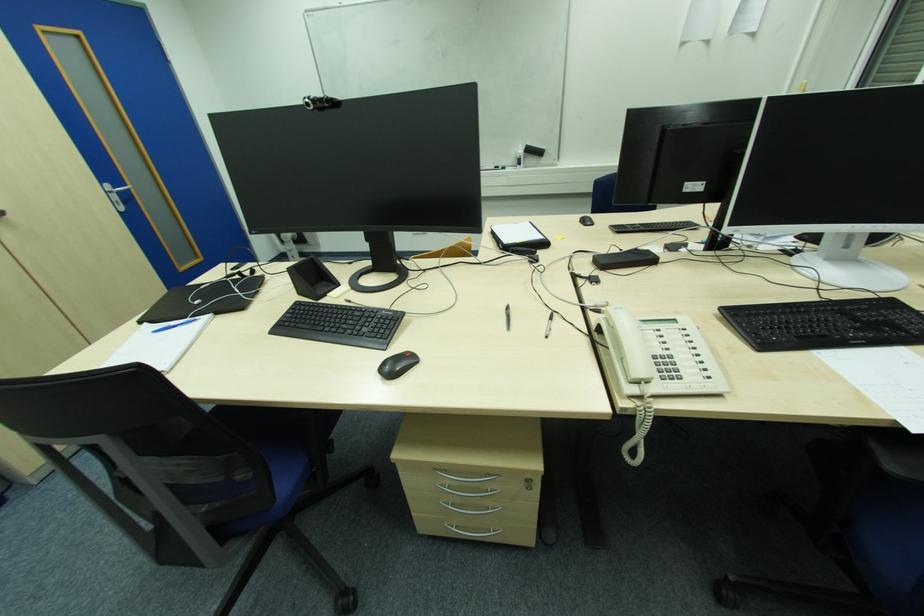
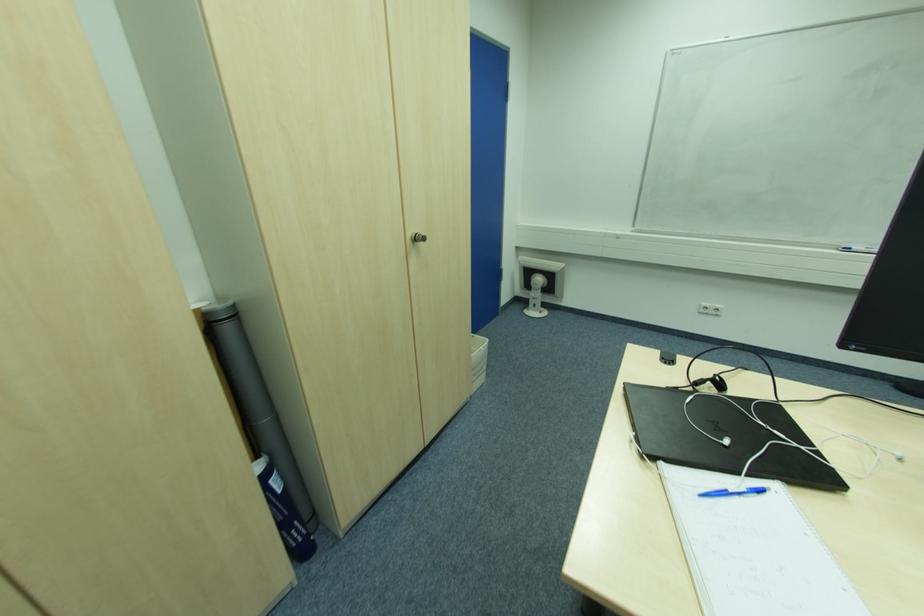
In the second image, find the point that corresponds to point (229, 278) in the first image.

(699, 385)